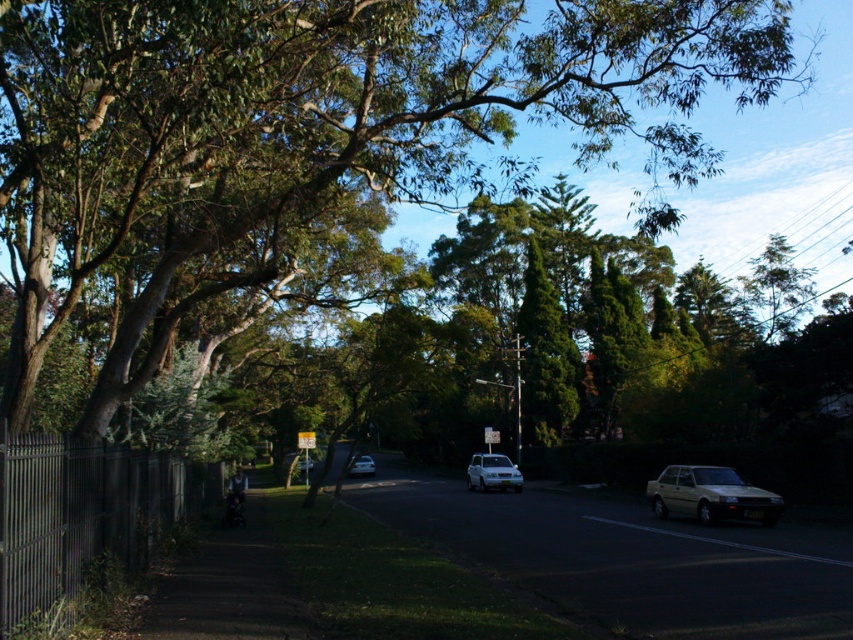
You are standing on the suburban street looking at the scene. There is a point marked at coordinates (309, 124). What object is located at that point?

The point at coordinates (309, 124) marks the green leafy tree at upper center.

You are a delivery driver who needs to park your car in the driveway behind the silver metallic sedan at center and the metallic silver sedan at center. Which sedan should you park behind to ensure proper clearance for both vehicles?

The silver metallic sedan at center is positioned under the metallic silver sedan at center, so you should park behind the metallic silver sedan at center to ensure proper clearance for both vehicles.

You are a delivery driver who needs to park your truck, which is 2 meters wide, in this suburban street scene. You see a white matte car at center and a metallic silver sedan at center. Can you fit your truck between them if they are parked side by side?

The white matte car at center might be wider than metallic silver sedan at center, so the combined width of both vehicles could exceed the available space. Therefore, it is uncertain if the truck can fit between them without further information on their exact widths.